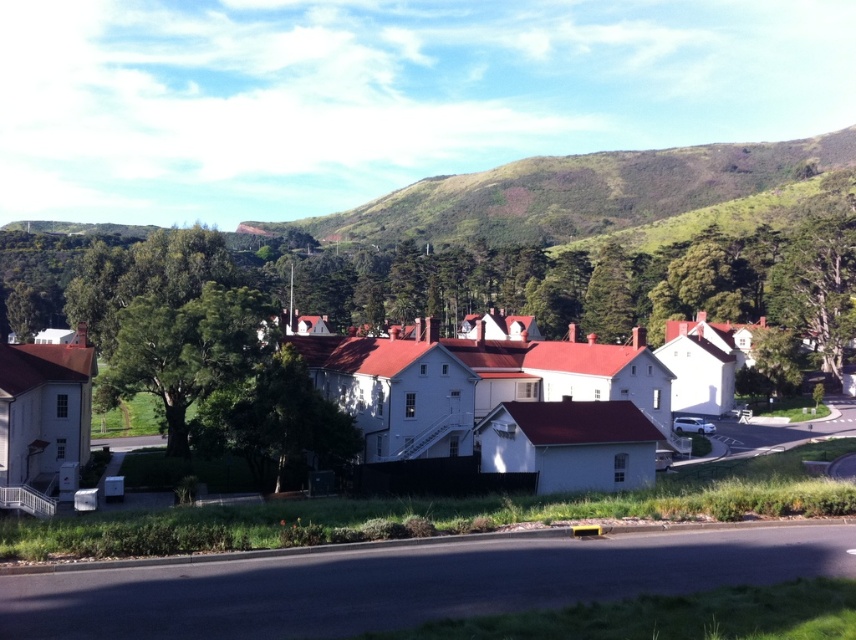
You are standing at the yellow curb along the roadside in the suburban scene. Looking towards the row of white houses with red roofs, where would you see the point marked at coordinates (575, 193)?

The point marked at coordinates (575, 193) corresponds to the green grassy hillside at upper center.

You are a gardener planning to plant a new tree in this suburban area. The green leafy tree at center and the green textured tree at right are existing trees. Which existing tree should you use as a reference for the size of the new tree if you want it to be larger than both?

You should use the green textured tree at right as a reference because it is larger than the green leafy tree at center.